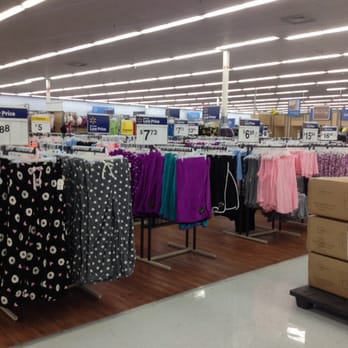
Image resolution: width=348 pixels, height=348 pixels. Find the location of `back wall`. back wall is located at coordinates (76, 107), (123, 108), (16, 100).